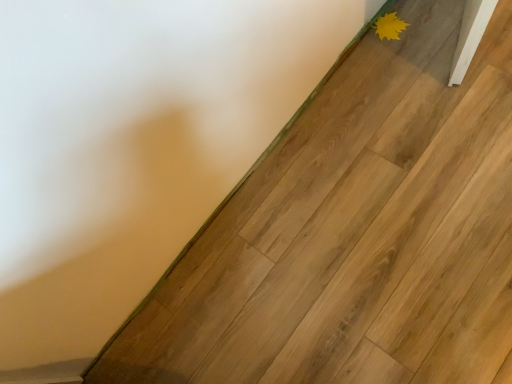
What are the coordinates of `yellow matte maple leaf at upper right` in the screenshot? It's located at (389, 26).

Describe the element at coordinates (389, 26) in the screenshot. Image resolution: width=512 pixels, height=384 pixels. I see `yellow matte maple leaf at upper right` at that location.

The image size is (512, 384). I want to click on yellow matte maple leaf at upper right, so click(389, 26).